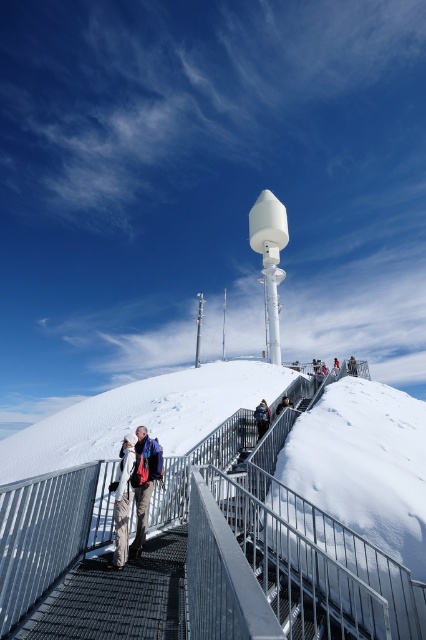
Between point (305, 589) and point (146, 442), which one is positioned behind?

Point (305, 589)

Can you confirm if metallic mesh stairs at center is positioned above khaki fabric pants at center?

Actually, metallic mesh stairs at center is below khaki fabric pants at center.

Between point (298, 572) and point (115, 490), which one is positioned behind?

Point (298, 572)

Find the location of `metallic mesh stairs at center`. metallic mesh stairs at center is located at coordinates (299, 589).